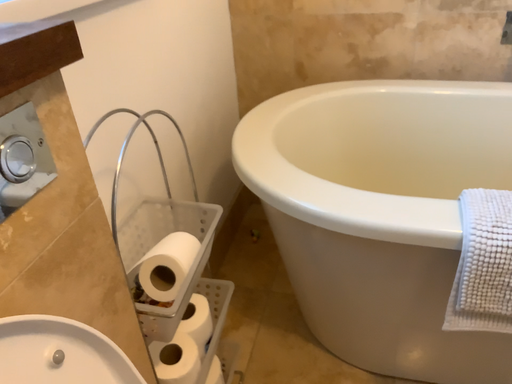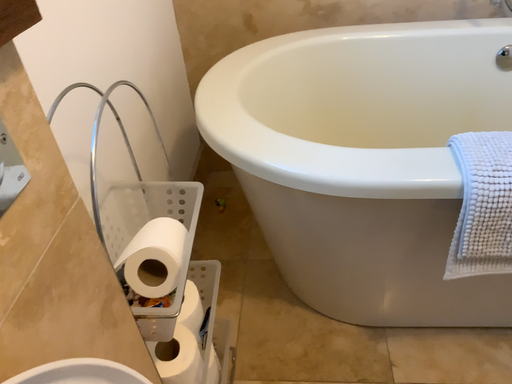
Question: How did the camera likely rotate when shooting the video?

Choices:
 (A) rotated right
 (B) rotated left

Answer: (A)